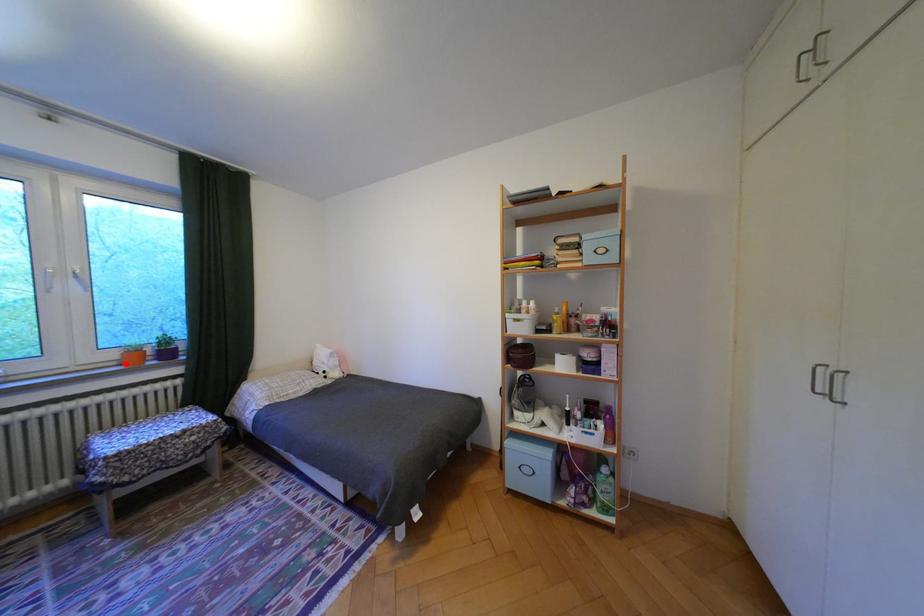
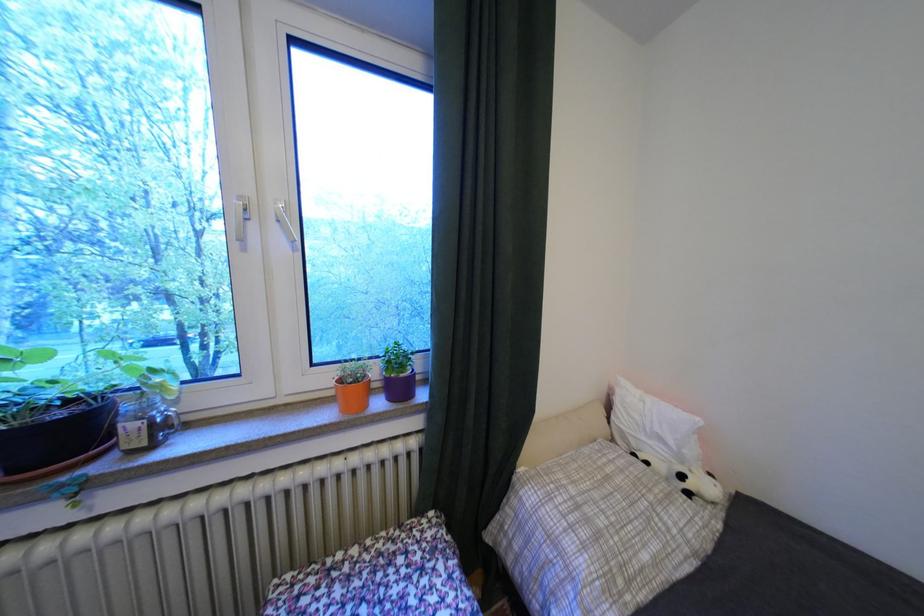
Question: I am providing you with two images of the same scene from different viewpoints. Image1 has a red point marked. In image2, the corresponding 3D location appears at what relative position? Reply with the corresponding letter.

Choices:
 (A) Closer
 (B) Farther

Answer: (B)